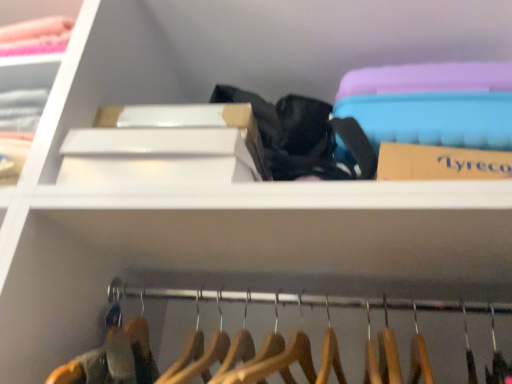
In order to face white matte box at center, should I rotate leftwards or rightwards?

Turn left approximately 13.081 degrees to face it.

The image size is (512, 384). What do you see at coordinates (165, 146) in the screenshot? I see `white matte box at center` at bounding box center [165, 146].

The image size is (512, 384). Identify the location of white matte box at center. (165, 146).

You are a GUI agent. You are given a task and a screenshot of the screen. Output one action in this format:
    pyautogui.click(x=<x>, y=<y>)
    Task: Click on the white matte box at center
    Image resolution: width=512 pixels, height=384 pixels.
    Given the screenshot: What is the action you would take?
    pyautogui.click(x=165, y=146)